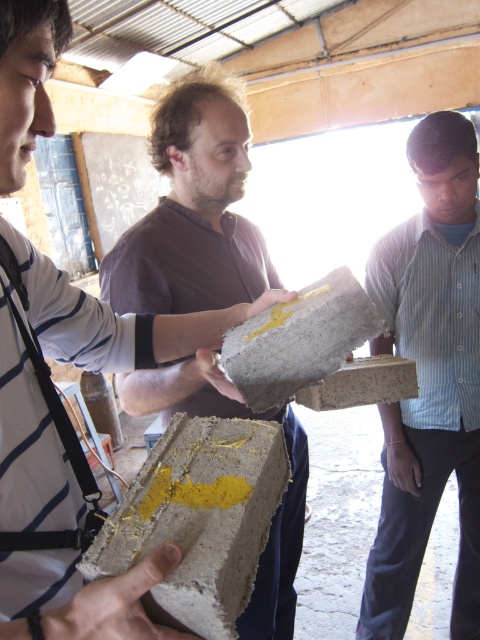
You are standing in the workshop and want to reach the point marked at coordinates (422, 120). If you can extend your arm 1.2 meters, can you reach it?

The point marked at coordinates (422, 120) is 1.56 meters away from the viewer. Since your arm can only extend 1.2 meters, you cannot reach it.

You are standing in the workshop and need to locate the matte concrete block at center. Which direction should you move relative to the blue striped shirt at right to find it?

The matte concrete block at center is to the left of the blue striped shirt at right, so you should move to the left of the blue striped shirt at right to find it.